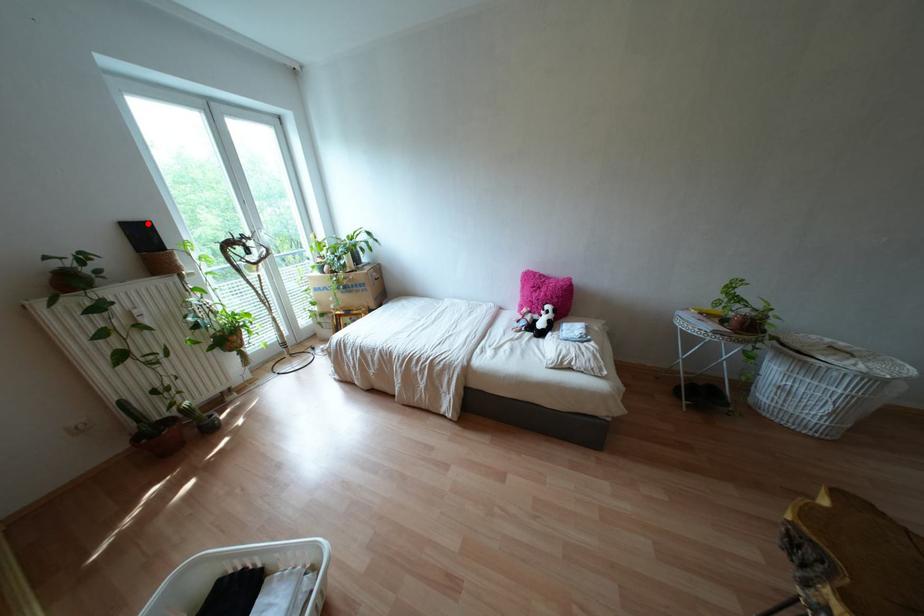
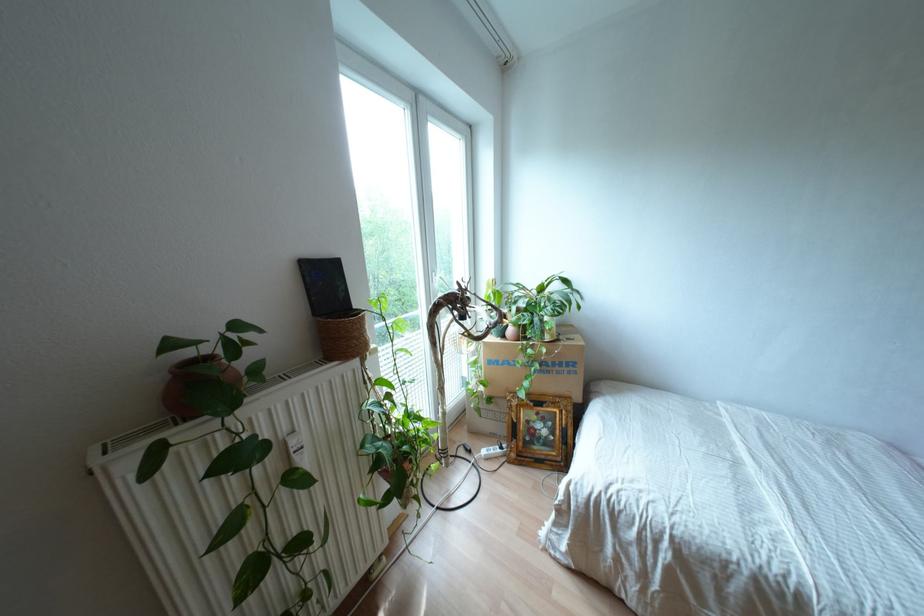
Where in the second image is the point corresponding to the highlighted location from the first image?

(334, 262)